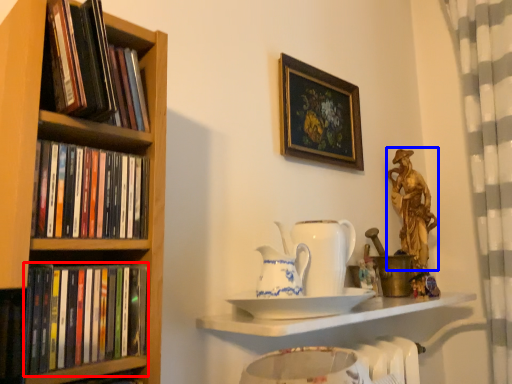
Question: Which of the following is the closest to the observer, book (highlighted by a red box) or deity (highlighted by a blue box)?

Choices:
 (A) book
 (B) deity

Answer: (A)